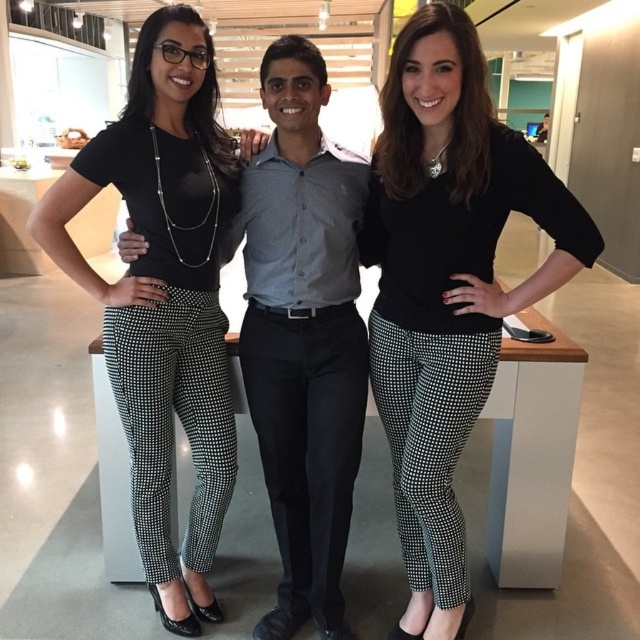
You are a fashion designer observing three people in an office setting. You notice the black textured pants at center and the black textured pants at left. Which pair of pants is shorter in height?

The black textured pants at center has a lesser height compared to black textured pants at left, so the black textured pants at center is shorter.